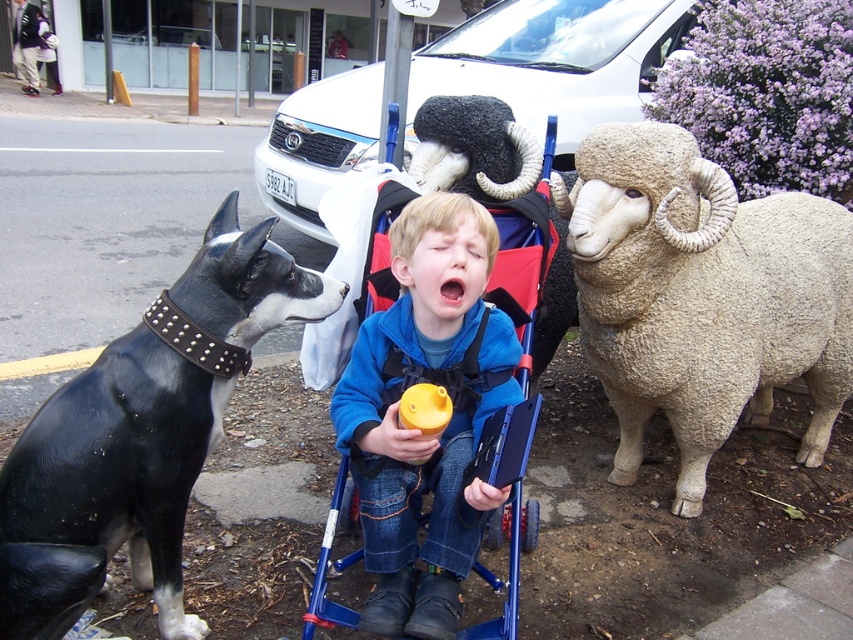
You are a photographer positioned at the center of the scene. You want to capture a photo that includes both the black leather dog at left and the child in the stroller. Based on their positions, which direction should you move to ensure both are in frame?

Since the black leather dog at left is positioned at point (141, 435), you should move to the left to ensure both the black leather dog at left and the child in the stroller are in frame.

You are a parent trying to ensure your child stays warm while playing outside. The child is wearing a blue fleece jacket at center and there is a white woolen sheep at right nearby. Which item is higher in elevation?

The white woolen sheep at right is above the blue fleece jacket at center, so the sheep is higher in elevation.

You are a parent trying to decide which item to hand to your child in the stroller. The child is holding a yellow object and a smartphone. You have a blue fleece jacket at center and a white woolen sheep at right nearby. Which item is bigger and easier to grab?

The white woolen sheep at right is larger in size than the blue fleece jacket at center, so it is easier to grab.